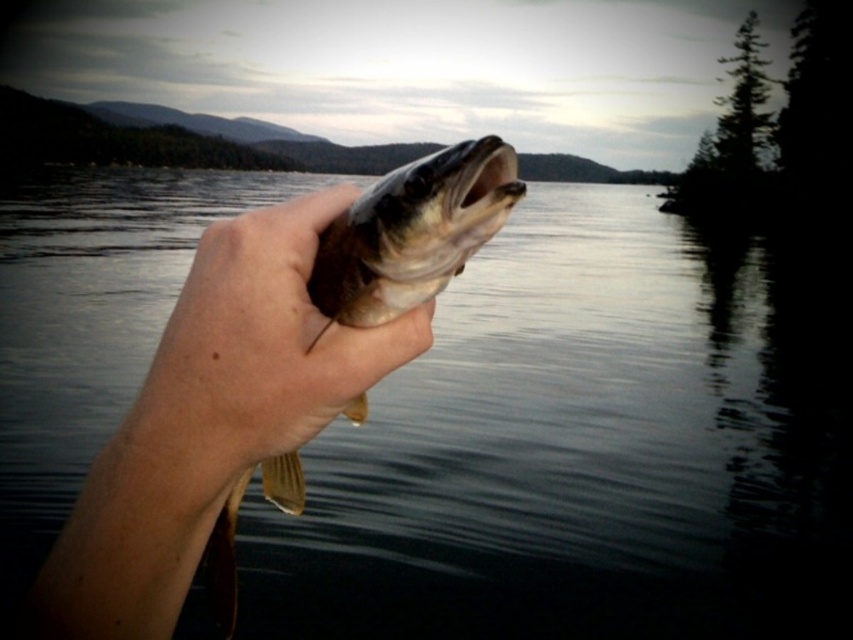
Does point (780, 476) lie behind point (306, 250)?

Yes, it is behind point (306, 250).

Does glossy water at center have a greater width compared to smooth skin hand at center?

Correct, the width of glossy water at center exceeds that of smooth skin hand at center.

Locate an element on the screen. The width and height of the screenshot is (853, 640). glossy water at center is located at coordinates (585, 449).

The image size is (853, 640). What are the coordinates of `glossy water at center` in the screenshot? It's located at (585, 449).